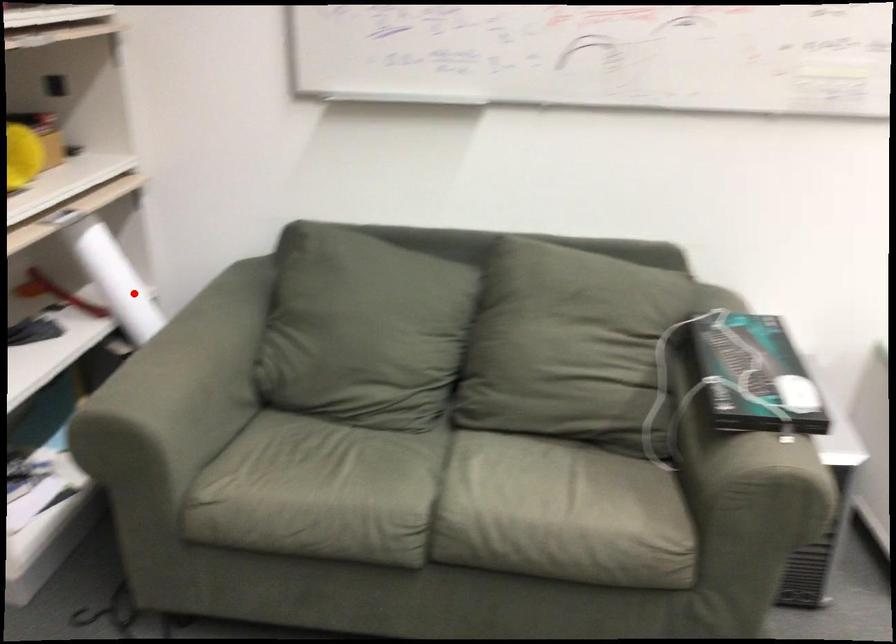
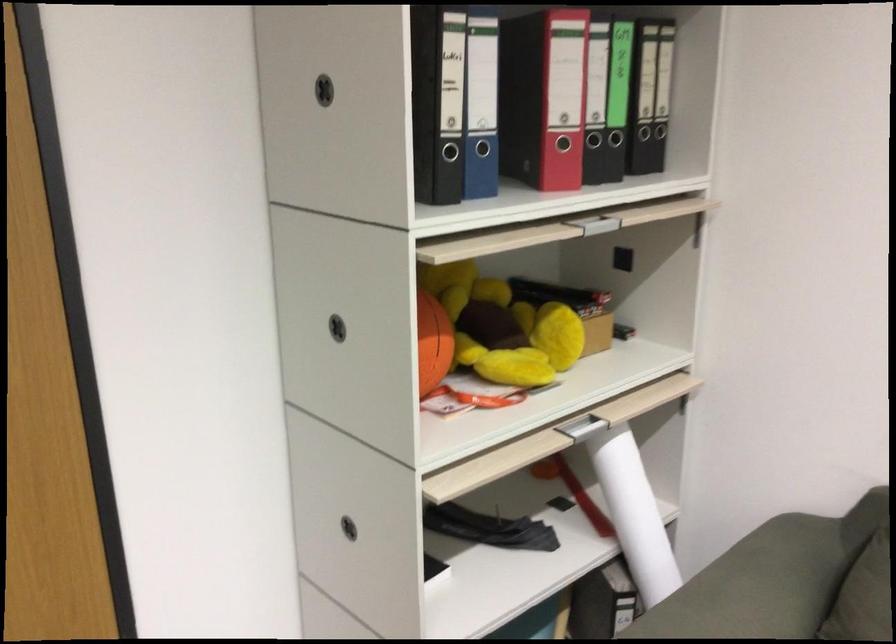
Locate, in the second image, the point that corresponds to the highlighted location in the first image.

(633, 514)